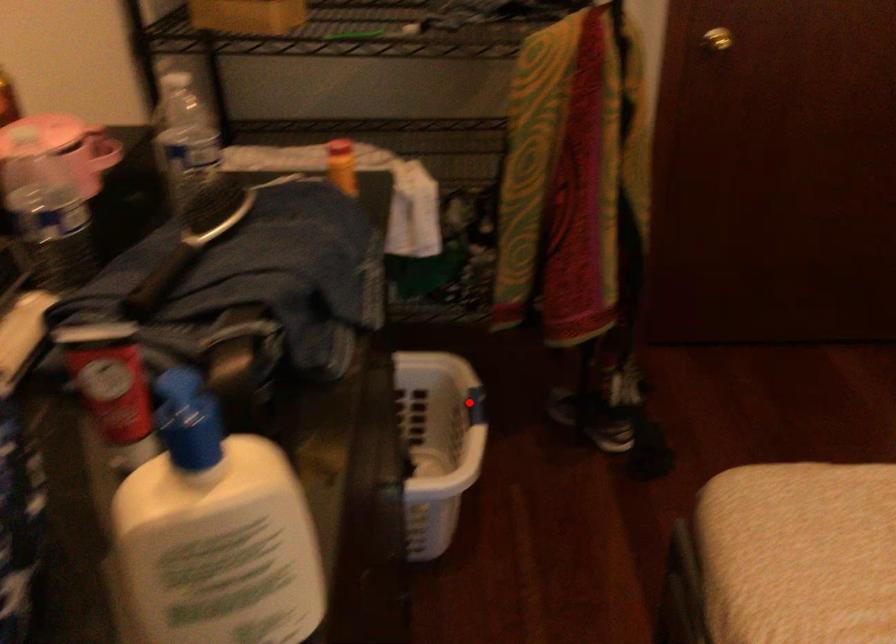
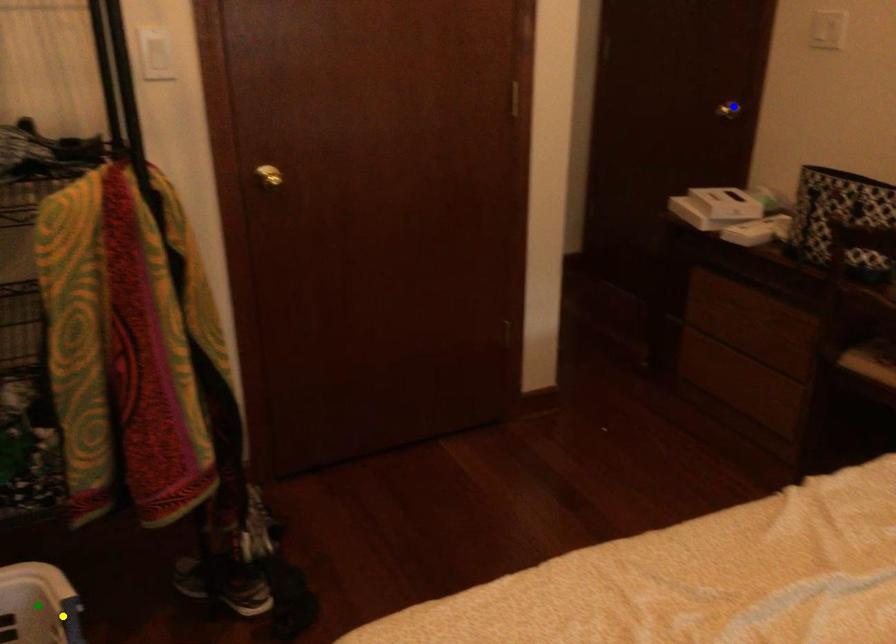
Question: I am providing you with two images of the same scene from different viewpoints. A red point is marked on the first image. You are given multiple points on the second image. Which spot in image 2 lines up with the point in image 1?

Choices:
 (A) yellow point
 (B) blue point
 (C) green point

Answer: (A)